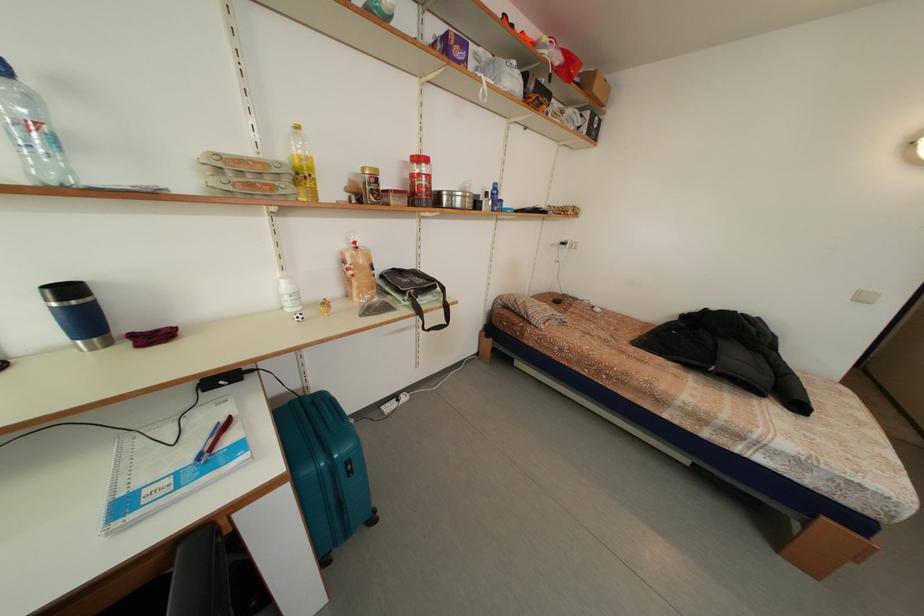
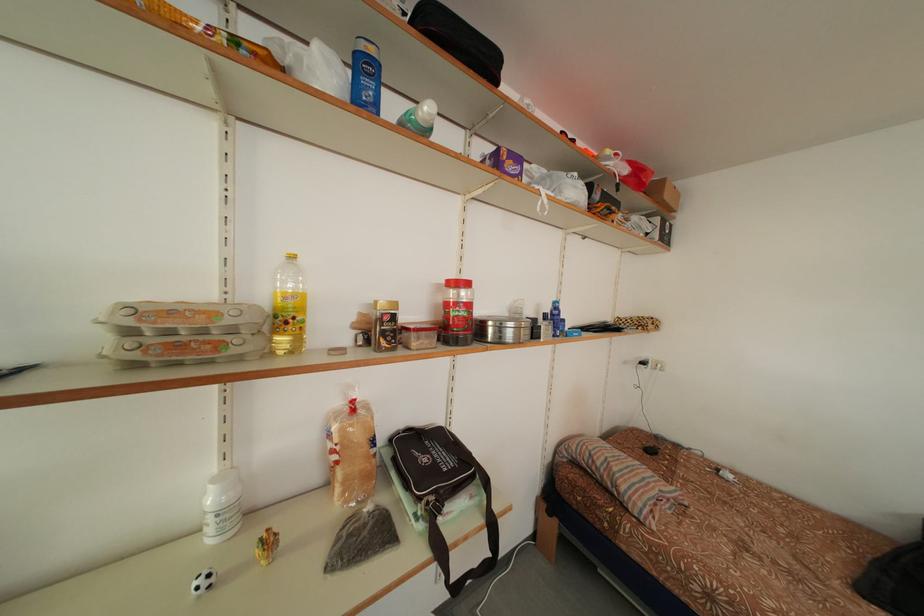
Question: Which direction would the cameraman need to move to produce the second image? Reply with the corresponding letter.

Choices:
 (A) Left
 (B) Right
 (C) Forward
 (D) Backward

Answer: (C)